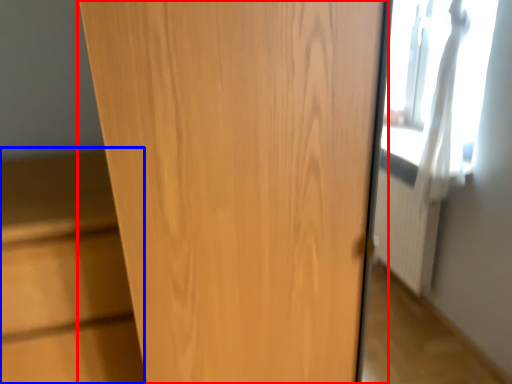
Question: Which of the following is the farthest to the observer, door (highlighted by a red box) or cabinetry (highlighted by a blue box)?

Choices:
 (A) door
 (B) cabinetry

Answer: (B)